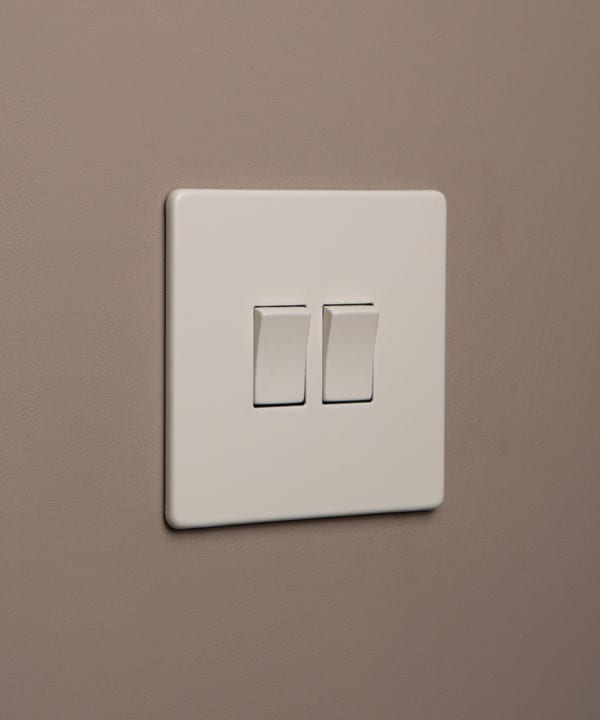
Locate an element on the screen. This screenshot has width=600, height=720. opening for switch is located at coordinates click(287, 404).